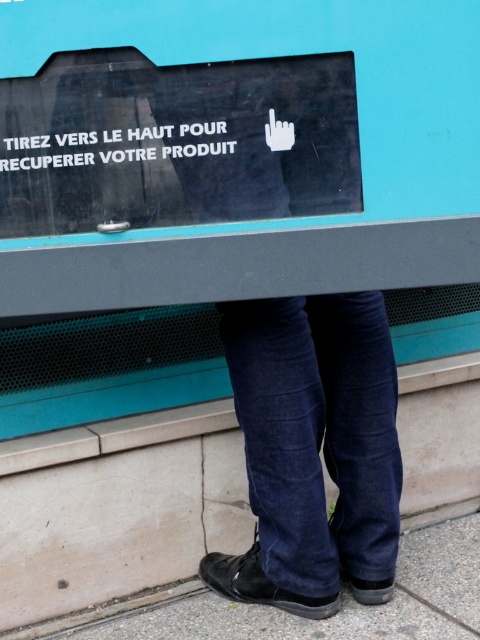
Where is `black glossy sign at upper center`? black glossy sign at upper center is located at coordinates (176, 141).

Between black glossy sign at upper center and denim jeans at lower center, which one appears on the right side from the viewer's perspective?

Positioned to the right is denim jeans at lower center.

Is point (100, 163) behind point (284, 380)?

No, (100, 163) is closer to viewer.

I want to click on black glossy sign at upper center, so click(176, 141).